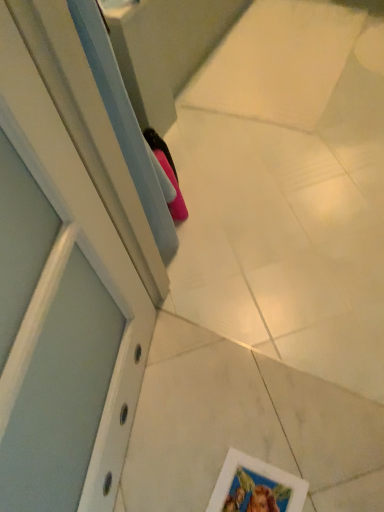
Where is `pink matte shoe at center`? pink matte shoe at center is located at coordinates (167, 173).

What do you see at coordinates (167, 173) in the screenshot? The width and height of the screenshot is (384, 512). I see `pink matte shoe at center` at bounding box center [167, 173].

What is the approximate height of white matte picture frame at lower right?

0.39 inches.

The image size is (384, 512). Find the location of `white matte picture frame at lower right`. white matte picture frame at lower right is located at coordinates (256, 487).

This screenshot has height=512, width=384. Describe the element at coordinates (256, 487) in the screenshot. I see `white matte picture frame at lower right` at that location.

Image resolution: width=384 pixels, height=512 pixels. I want to click on pink matte shoe at center, so click(167, 173).

In the image, is white matte picture frame at lower right on the left side or the right side of pink matte shoe at center?

From the image, it's evident that white matte picture frame at lower right is to the right of pink matte shoe at center.

Which object is closer to the camera, white matte picture frame at lower right or pink matte shoe at center?

white matte picture frame at lower right is in front.

Between point (262, 480) and point (182, 196), which one is positioned in front?

The point (262, 480) is closer.

From the image's perspective, is white matte picture frame at lower right positioned above or below pink matte shoe at center?

white matte picture frame at lower right is situated lower than pink matte shoe at center in the image.

From a real-world perspective, is white matte picture frame at lower right physically located above or below pink matte shoe at center?

In terms of real-world spatial position, white matte picture frame at lower right is below pink matte shoe at center.

Consider the image. Which object is wider, white matte picture frame at lower right or pink matte shoe at center?

white matte picture frame at lower right is wider.

Which of these two, white matte picture frame at lower right or pink matte shoe at center, stands shorter?

Standing shorter between the two is white matte picture frame at lower right.

Considering the sizes of objects white matte picture frame at lower right and pink matte shoe at center in the image provided, who is smaller, white matte picture frame at lower right or pink matte shoe at center?

white matte picture frame at lower right is smaller.

Is white matte picture frame at lower right surrounding pink matte shoe at center?

No, pink matte shoe at center is not surrounded by white matte picture frame at lower right.

Are white matte picture frame at lower right and pink matte shoe at center located far from each other?

That's not correct — white matte picture frame at lower right is a little close to pink matte shoe at center.

Does white matte picture frame at lower right turn towards pink matte shoe at center?

No.

How many degrees apart are the facing directions of white matte picture frame at lower right and pink matte shoe at center?

They differ by 86.9 degrees in their facing directions.

I want to click on picture frame on the right of pink matte shoe at center, so click(256, 487).

In the scene shown: Is pink matte shoe at center to the left of white matte picture frame at lower right from the viewer's perspective?

Yes, pink matte shoe at center is to the left of white matte picture frame at lower right.

In the scene shown: Which object is further away from the camera taking this photo, pink matte shoe at center or white matte picture frame at lower right?

pink matte shoe at center is behind.

Which point is more distant from viewer, (x=148, y=135) or (x=279, y=475)?

Point (x=148, y=135)

From the image's perspective, which is above, pink matte shoe at center or white matte picture frame at lower right?

pink matte shoe at center is shown above in the image.

From the picture: From a real-world perspective, is pink matte shoe at center over white matte picture frame at lower right?

Correct, in the physical world, pink matte shoe at center is higher than white matte picture frame at lower right.

Consider the image. Is pink matte shoe at center wider or thinner than white matte picture frame at lower right?

pink matte shoe at center is thinner than white matte picture frame at lower right.

Who is shorter, pink matte shoe at center or white matte picture frame at lower right?

white matte picture frame at lower right.

Who is smaller, pink matte shoe at center or white matte picture frame at lower right?

With smaller size is white matte picture frame at lower right.

Is pink matte shoe at center spatially inside white matte picture frame at lower right, or outside of it?

pink matte shoe at center cannot be found inside white matte picture frame at lower right.

Would you say pink matte shoe at center is a long distance from white matte picture frame at lower right?

pink matte shoe at center is actually quite close to white matte picture frame at lower right.

Is pink matte shoe at center oriented towards white matte picture frame at lower right?

No.

How many degrees apart are the facing directions of pink matte shoe at center and white matte picture frame at lower right?

They differ by 86.9 degrees in their facing directions.

This screenshot has width=384, height=512. Find the location of `picture frame on the right of pink matte shoe at center`. picture frame on the right of pink matte shoe at center is located at coordinates (256, 487).

You are a GUI agent. You are given a task and a screenshot of the screen. Output one action in this format:
    pyautogui.click(x=<x>, y=<y>)
    Task: Click on the picture frame below the pink matte shoe at center (from the image's perspective)
    This screenshot has width=384, height=512.
    Given the screenshot: What is the action you would take?
    pyautogui.click(x=256, y=487)

There is a white matte picture frame at lower right. Find the location of `shoe above it (from a real-world perspective)`. shoe above it (from a real-world perspective) is located at coordinates (167, 173).